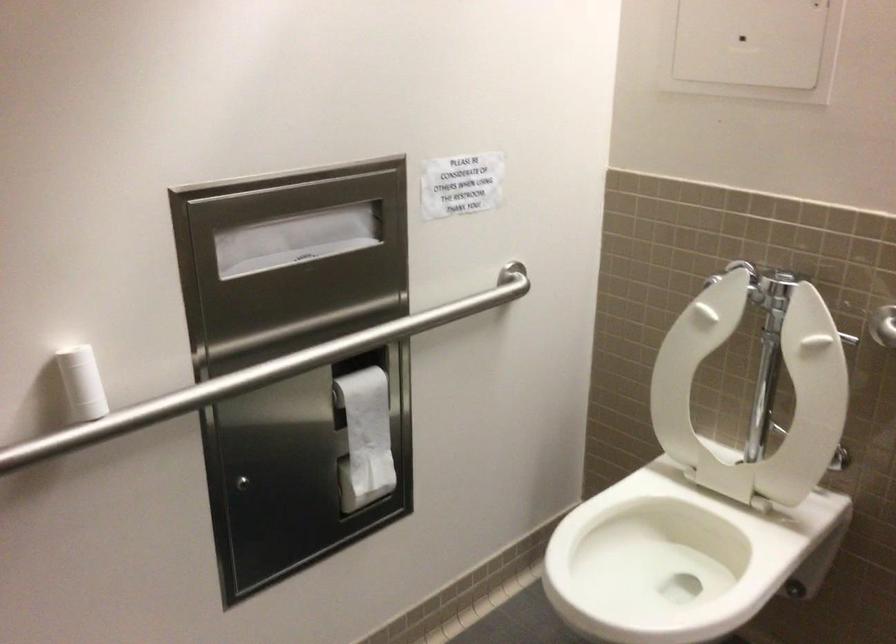
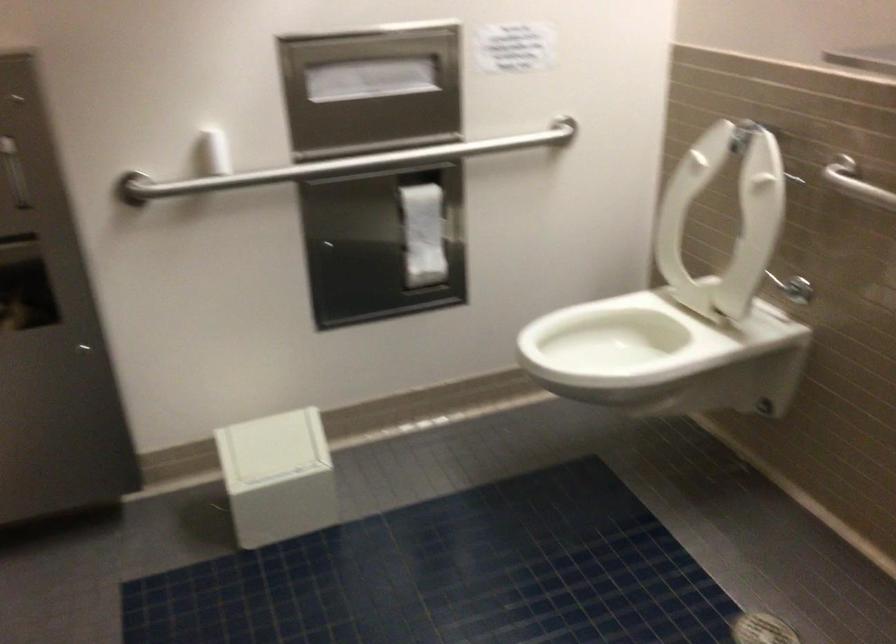
The point at [366,440] is marked in the first image. Where is the corresponding point in the second image?

(423, 234)